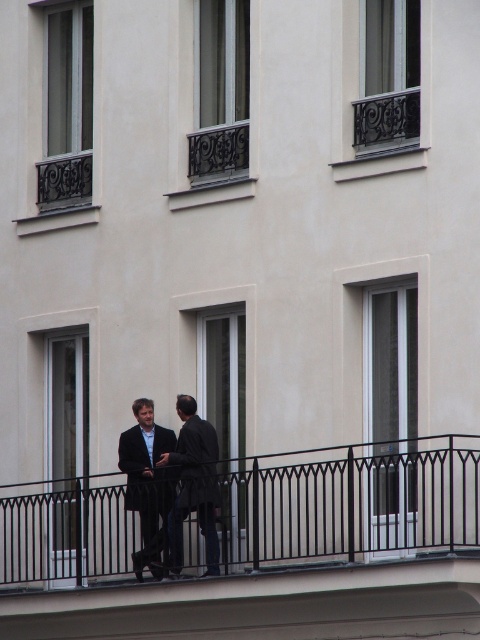
Question: Does black metal railing at center lie behind dark gray wool jacket at center?

Choices:
 (A) yes
 (B) no

Answer: (B)

Question: Which point is closer to the camera?

Choices:
 (A) dark blue wool suit at center
 (B) black metal railing at center
 (C) dark gray wool jacket at center
 (D) dark gray coat at center

Answer: (B)

Question: Can you confirm if dark gray coat at center is wider than dark gray wool jacket at center?

Choices:
 (A) no
 (B) yes

Answer: (B)

Question: Which point is closer to the camera taking this photo?

Choices:
 (A) click(181, 552)
 (B) click(92, 544)
 (C) click(167, 432)
 (D) click(189, 500)

Answer: (D)

Question: Is dark gray coat at center thinner than dark gray wool jacket at center?

Choices:
 (A) no
 (B) yes

Answer: (A)

Question: Which point is farther from the camera taking this photo?

Choices:
 (A) (186, 497)
 (B) (131, 440)

Answer: (B)